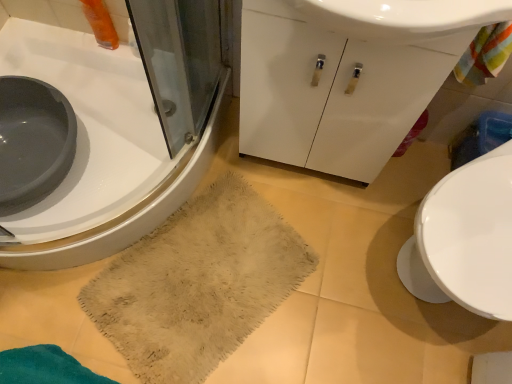
Question: Is beige fuzzy rug at lower center located outside white glossy sink at lower left?

Choices:
 (A) yes
 (B) no

Answer: (A)

Question: From a real-world perspective, is beige fuzzy rug at lower center on white glossy sink at lower left?

Choices:
 (A) no
 (B) yes

Answer: (A)

Question: Is beige fuzzy rug at lower center thinner than white glossy sink at lower left?

Choices:
 (A) yes
 (B) no

Answer: (A)

Question: Does beige fuzzy rug at lower center have a greater height compared to white glossy sink at lower left?

Choices:
 (A) yes
 (B) no

Answer: (B)

Question: From a real-world perspective, is beige fuzzy rug at lower center positioned under white glossy sink at lower left based on gravity?

Choices:
 (A) no
 (B) yes

Answer: (B)

Question: Considering their positions, is white glossy cabinet at center located in front of or behind white glossy sink at lower left?

Choices:
 (A) behind
 (B) front

Answer: (B)

Question: Is white glossy cabinet at center inside the boundaries of white glossy sink at lower left, or outside?

Choices:
 (A) outside
 (B) inside

Answer: (A)

Question: In terms of height, does white glossy cabinet at center look taller or shorter compared to white glossy sink at lower left?

Choices:
 (A) tall
 (B) short

Answer: (A)

Question: Is white glossy cabinet at center bigger or smaller than white glossy sink at lower left?

Choices:
 (A) small
 (B) big

Answer: (A)

Question: Is white glossy cabinet at center taller or shorter than beige fuzzy rug at lower center?

Choices:
 (A) short
 (B) tall

Answer: (B)

Question: Is white glossy cabinet at center inside the boundaries of beige fuzzy rug at lower center, or outside?

Choices:
 (A) inside
 (B) outside

Answer: (B)

Question: From a real-world perspective, is white glossy cabinet at center positioned above or below beige fuzzy rug at lower center?

Choices:
 (A) above
 (B) below

Answer: (A)

Question: Considering the positions of white glossy cabinet at center and beige fuzzy rug at lower center in the image, is white glossy cabinet at center wider or thinner than beige fuzzy rug at lower center?

Choices:
 (A) thin
 (B) wide

Answer: (A)

Question: Considering the positions of beige fuzzy rug at lower center and white glossy sink at lower left in the image, is beige fuzzy rug at lower center wider or thinner than white glossy sink at lower left?

Choices:
 (A) thin
 (B) wide

Answer: (A)

Question: In terms of size, does beige fuzzy rug at lower center appear bigger or smaller than white glossy sink at lower left?

Choices:
 (A) small
 (B) big

Answer: (A)